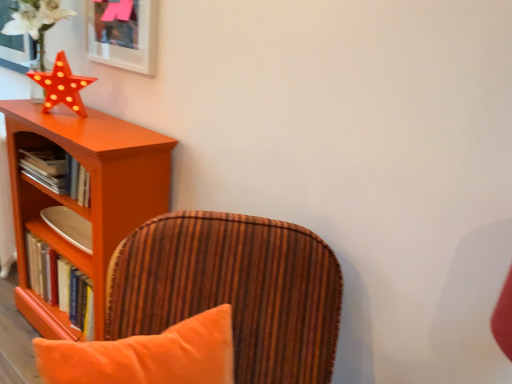
You are a GUI agent. You are given a task and a screenshot of the screen. Output one action in this format:
    pyautogui.click(x=<x>, y=<y>)
    Task: Click on the velvet orange chair at center
    
    Given the screenshot: What is the action you would take?
    pyautogui.click(x=238, y=288)

The image size is (512, 384). In order to click on matte orange star at upper left in this screenshot , I will do `click(61, 86)`.

Find the location of `orange wood shelf at left`. orange wood shelf at left is located at coordinates (91, 195).

Image resolution: width=512 pixels, height=384 pixels. I want to click on hardcover books at left, the first book when ordered from top to bottom, so click(57, 173).

Identify the location of shelf below the matte orange star at upper left (from the image's perspective). 91,195.

Consider the image. From the image's perspective, is orange wood shelf at left on top of matte orange star at upper left?

No, from the image's perspective, orange wood shelf at left is not above matte orange star at upper left.

Considering the sizes of objects orange wood shelf at left and matte orange star at upper left in the image provided, who is thinner, orange wood shelf at left or matte orange star at upper left?

matte orange star at upper left.

From the image's perspective, is hardcover books at left, the first book when ordered from top to bottom, above velvet orange chair at center?

Yes.

Is hardcover books at left, which appears as the second book when ordered from the bottom, outside of velvet orange chair at center?

That's correct, hardcover books at left, which appears as the second book when ordered from the bottom, is outside of velvet orange chair at center.

Between hardcover books at left, the first book when ordered from top to bottom, and velvet orange chair at center, which one appears on the right side from the viewer's perspective?

velvet orange chair at center is more to the right.

Looking at this image, is hardcover books at left, which appears as the second book when ordered from the bottom, inside the boundaries of matte white picture frame at upper left, or outside?

hardcover books at left, which appears as the second book when ordered from the bottom, is outside matte white picture frame at upper left.

Which book is the 1st one when counting from the back of the matte white picture frame at upper left? Please provide its 2D coordinates.

[(57, 173)]

Is hardcover books at left, the first book when ordered from top to bottom, smaller than matte white picture frame at upper left?

No, hardcover books at left, the first book when ordered from top to bottom, is not smaller than matte white picture frame at upper left.

Based on the photo, considering their positions, is velvet orange chair at center located in front of or behind matte orange star at upper left?

velvet orange chair at center is in front of matte orange star at upper left.

Identify the location of star above the velvet orange chair at center (from a real-world perspective). (61, 86).

Which object is thinner, velvet orange chair at center or matte orange star at upper left?

matte orange star at upper left is thinner.

Can you confirm if hardcover book at left, which ranks as the 1th book in bottom-to-top order, is taller than velvet orange chair at center?

In fact, hardcover book at left, which ranks as the 1th book in bottom-to-top order, may be shorter than velvet orange chair at center.

From a real-world perspective, is hardcover book at left, the 2th book in the top-to-bottom sequence, on top of velvet orange chair at center?

Incorrect, from a real-world perspective, hardcover book at left, the 2th book in the top-to-bottom sequence, is lower than velvet orange chair at center.

Find the location of a particular element. The image size is (512, 384). chair above the hardcover book at left, which ranks as the 1th book in bottom-to-top order (from a real-world perspective) is located at coordinates (238, 288).

Is hardcover book at left, which ranks as the 1th book in bottom-to-top order, at the right side of velvet orange chair at center?

No.

The height and width of the screenshot is (384, 512). What are the coordinates of `star in front of the hardcover books at left, which appears as the second book when ordered from the bottom` in the screenshot? It's located at (61, 86).

Is hardcover books at left, the first book when ordered from top to bottom, to the left of matte orange star at upper left from the viewer's perspective?

Yes.

Does hardcover books at left, which appears as the second book when ordered from the bottom, turn towards matte orange star at upper left?

No.

Between hardcover books at left, the first book when ordered from top to bottom, and matte orange star at upper left, which one is positioned in front?

matte orange star at upper left.

From a real-world perspective, is hardcover book at left, which ranks as the 1th book in bottom-to-top order, above or below matte white picture frame at upper left?

hardcover book at left, which ranks as the 1th book in bottom-to-top order, is below matte white picture frame at upper left.

How different are the orientations of hardcover book at left, which ranks as the 1th book in bottom-to-top order, and matte white picture frame at upper left in degrees?

There is a 0.000132-degree angle between the facing directions of hardcover book at left, which ranks as the 1th book in bottom-to-top order, and matte white picture frame at upper left.

Considering their positions, is hardcover book at left, the 2th book in the top-to-bottom sequence, located in front of or behind matte white picture frame at upper left?

Clearly, hardcover book at left, the 2th book in the top-to-bottom sequence, is behind matte white picture frame at upper left.

Locate an element on the screen. The width and height of the screenshot is (512, 384). picture frame on the right of hardcover book at left, which ranks as the 1th book in bottom-to-top order is located at coordinates (123, 33).

The width and height of the screenshot is (512, 384). What are the coordinates of `star behind the orange wood shelf at left` in the screenshot? It's located at (61, 86).

You are a GUI agent. You are given a task and a screenshot of the screen. Output one action in this format:
    pyautogui.click(x=<x>, y=<y>)
    Task: Click on the book above the velvet orange chair at center (from a real-world perspective)
    This screenshot has width=512, height=384.
    Given the screenshot: What is the action you would take?
    pyautogui.click(x=57, y=173)

When comparing their distances from orange wood shelf at left, does matte orange star at upper left or hardcover book at left, the 2th book in the top-to-bottom sequence, seem closer?

hardcover book at left, the 2th book in the top-to-bottom sequence.

Consider the image. When comparing their distances from matte orange star at upper left, does hardcover books at left, which appears as the second book when ordered from the bottom, or matte white picture frame at upper left seem further?

hardcover books at left, which appears as the second book when ordered from the bottom.

Looking at the image, which one is located further to hardcover book at left, the 2th book in the top-to-bottom sequence, orange wood shelf at left or matte orange star at upper left?

The object further to hardcover book at left, the 2th book in the top-to-bottom sequence, is matte orange star at upper left.

Which object lies nearer to the anchor point orange wood shelf at left, matte white picture frame at upper left or matte orange star at upper left?

matte orange star at upper left is closer to orange wood shelf at left.

Looking at the image, which one is located closer to orange wood shelf at left, hardcover book at left, which ranks as the 1th book in bottom-to-top order, or hardcover books at left, the first book when ordered from top to bottom?

Based on the image, hardcover books at left, the first book when ordered from top to bottom, appears to be nearer to orange wood shelf at left.

From the image, which object appears to be nearer to orange wood shelf at left, matte white picture frame at upper left or hardcover books at left, the first book when ordered from top to bottom?

The object closer to orange wood shelf at left is hardcover books at left, the first book when ordered from top to bottom.

Estimate the real-world distances between objects in this image. Which object is further from matte white picture frame at upper left, matte orange star at upper left or velvet orange chair at center?

velvet orange chair at center lies further to matte white picture frame at upper left than the other object.

When comparing their distances from velvet orange chair at center, does matte orange star at upper left or orange wood shelf at left seem closer?

Among the two, orange wood shelf at left is located nearer to velvet orange chair at center.

Find the location of a particular element. The width and height of the screenshot is (512, 384). star between matte white picture frame at upper left and velvet orange chair at center from top to bottom is located at coordinates (61, 86).

Find the location of `book between matte white picture frame at upper left and orange wood shelf at left in the vertical direction`. book between matte white picture frame at upper left and orange wood shelf at left in the vertical direction is located at coordinates (57, 173).

Identify the location of star between matte white picture frame at upper left and hardcover book at left, which ranks as the 1th book in bottom-to-top order, vertically. The height and width of the screenshot is (384, 512). (61, 86).

The width and height of the screenshot is (512, 384). I want to click on star between matte white picture frame at upper left and hardcover books at left, which appears as the second book when ordered from the bottom, in the vertical direction, so click(61, 86).